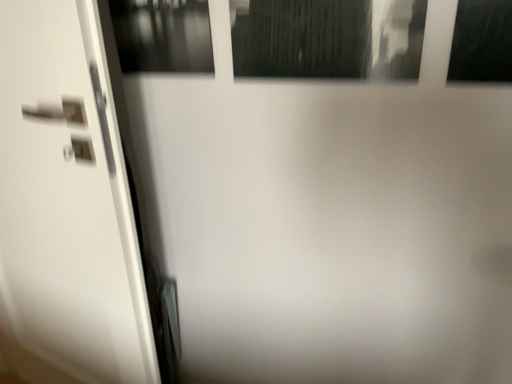
Question: From a real-world perspective, is transparent glass window at upper left physically located above or below white glossy door handle at left?

Choices:
 (A) below
 (B) above

Answer: (B)

Question: In terms of height, does transparent glass window at upper left look taller or shorter compared to white glossy door handle at left?

Choices:
 (A) short
 (B) tall

Answer: (A)

Question: In the image, is transparent glass window at upper left positioned in front of or behind white glossy door handle at left?

Choices:
 (A) behind
 (B) front

Answer: (A)

Question: Considering the positions of white glossy door handle at left and transparent glass window at upper left in the image, is white glossy door handle at left taller or shorter than transparent glass window at upper left?

Choices:
 (A) tall
 (B) short

Answer: (A)

Question: Is white glossy door handle at left in front of or behind transparent glass window at upper left in the image?

Choices:
 (A) behind
 (B) front

Answer: (B)

Question: Is white glossy door handle at left inside or outside of transparent glass window at upper left?

Choices:
 (A) outside
 (B) inside

Answer: (A)

Question: In terms of size, does white glossy door handle at left appear bigger or smaller than transparent glass window at upper left?

Choices:
 (A) small
 (B) big

Answer: (B)